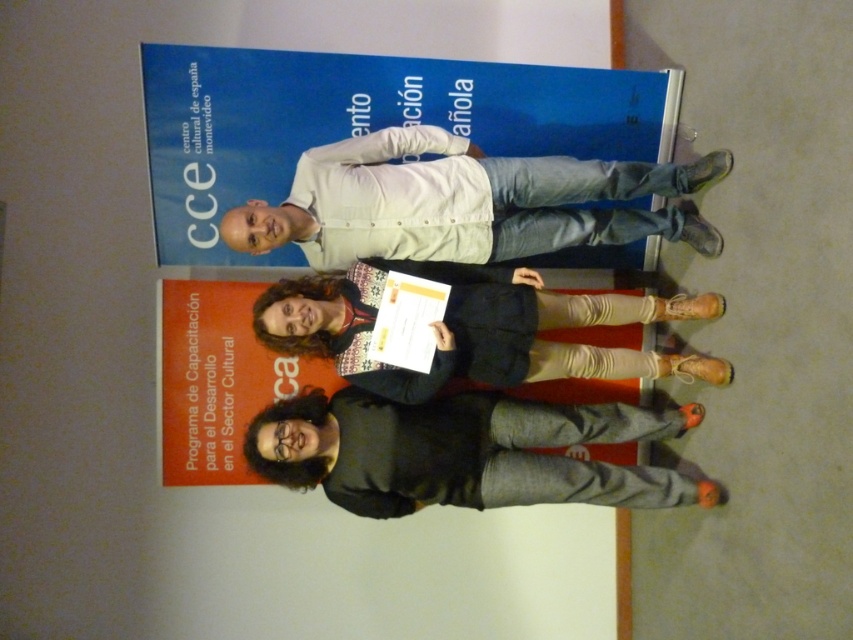
You are a photographer trying to capture a clear shot of the white matte shirt at upper center and the knitted sweater at center. Which one is closer to the camera?

The white matte shirt at upper center is positioned over the knitted sweater at center, so it is closer to the camera.

You are a photographer setting up for a group photo. You need to adjust the lighting so that both the gray cotton pants at lower center and the knitted sweater at center are well illuminated. Which object should you focus the light on first to ensure it is properly lit?

The gray cotton pants at lower center is closer to the viewer than the knitted sweater at center, so you should focus the light on the gray cotton pants at lower center first to ensure proper illumination.

Based on the scene description, which object is positioned lower in the image between the gray cotton pants at lower center and the knitted sweater at center?

The gray cotton pants at lower center is positioned below the knitted sweater at center according to the description.